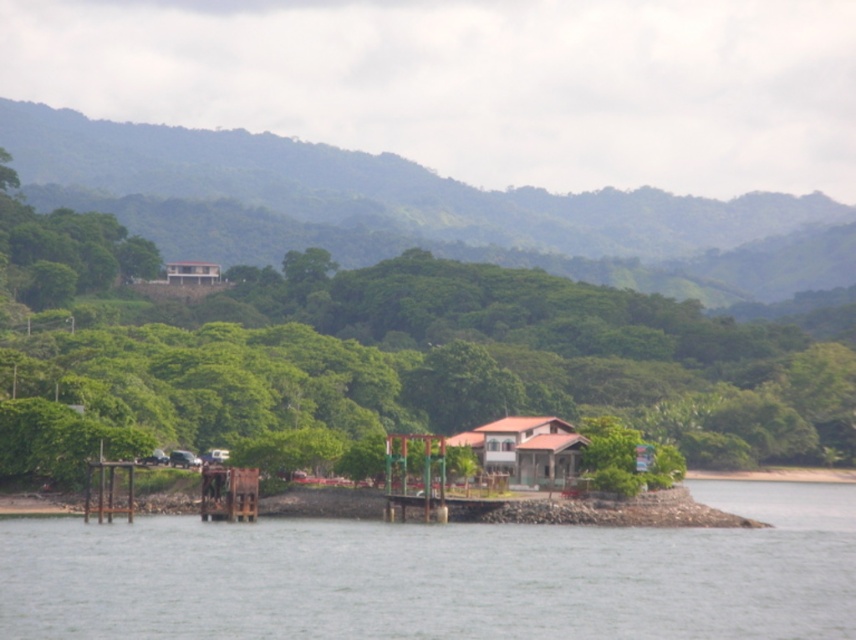
Which is in front, point (37, 364) or point (486, 440)?

Point (486, 440) is in front.

Does green leafy tree at center have a larger size compared to brown wooden house at center?

Indeed, green leafy tree at center has a larger size compared to brown wooden house at center.

Does point (415, 348) lie in front of point (486, 424)?

No, (415, 348) is behind (486, 424).

Identify the location of green leafy tree at center. This screenshot has height=640, width=856. (388, 355).

Who is more forward, (x=426, y=632) or (x=474, y=428)?

Point (x=426, y=632) is in front.

Is gray concrete river at lower center taller than brown wooden house at center?

Yes, gray concrete river at lower center is taller than brown wooden house at center.

Does point (140, 570) lie behind point (490, 433)?

No, (140, 570) is closer to viewer.

Locate an element on the screen. This screenshot has width=856, height=640. gray concrete river at lower center is located at coordinates (425, 579).

Is point (212, 488) in front of point (201, 280)?

Yes, point (212, 488) is closer to viewer.

Who is more forward, (227, 518) or (179, 273)?

Point (227, 518)

The width and height of the screenshot is (856, 640). I want to click on rusty metal dock at lower center, so click(229, 493).